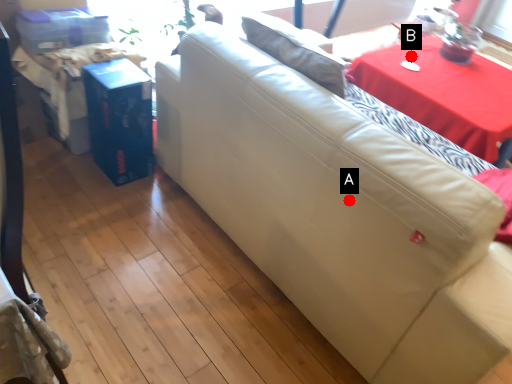
Question: Two points are circled on the image, labeled by A and B beside each circle. Which point is closer to the camera?

Choices:
 (A) A is closer
 (B) B is closer

Answer: (A)